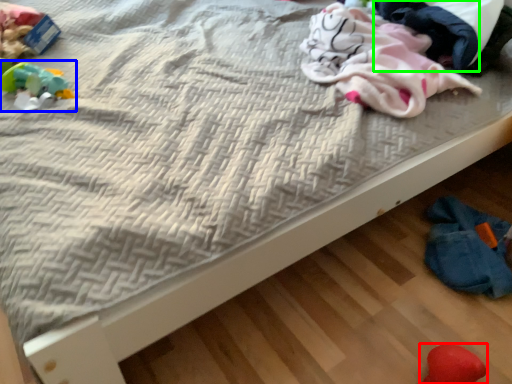
Question: Which is farther away from toy (highlighted by a red box)? toy (highlighted by a blue box) or clothing (highlighted by a green box)?

Choices:
 (A) toy
 (B) clothing

Answer: (A)